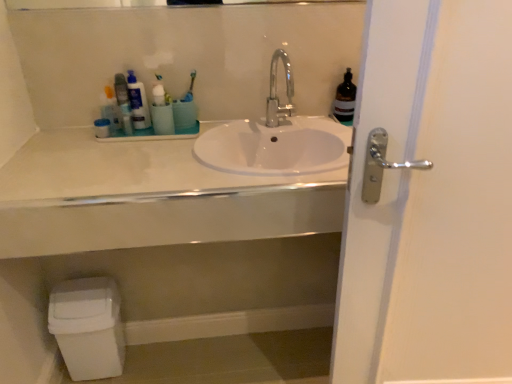
The width and height of the screenshot is (512, 384). What are the coordinates of `free space in front of white plastic container at upper left, which is the 2th toiletry from right to left` in the screenshot? It's located at (90, 154).